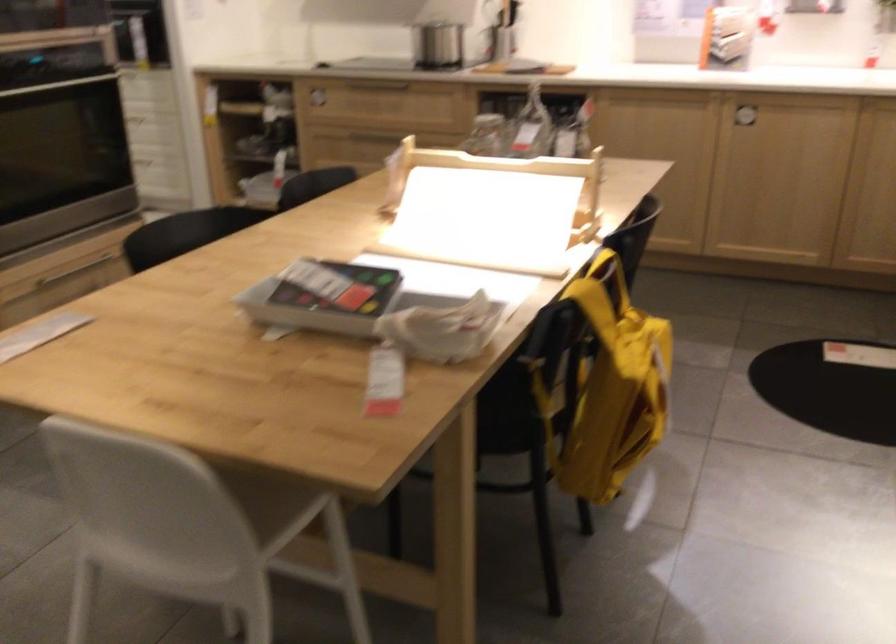
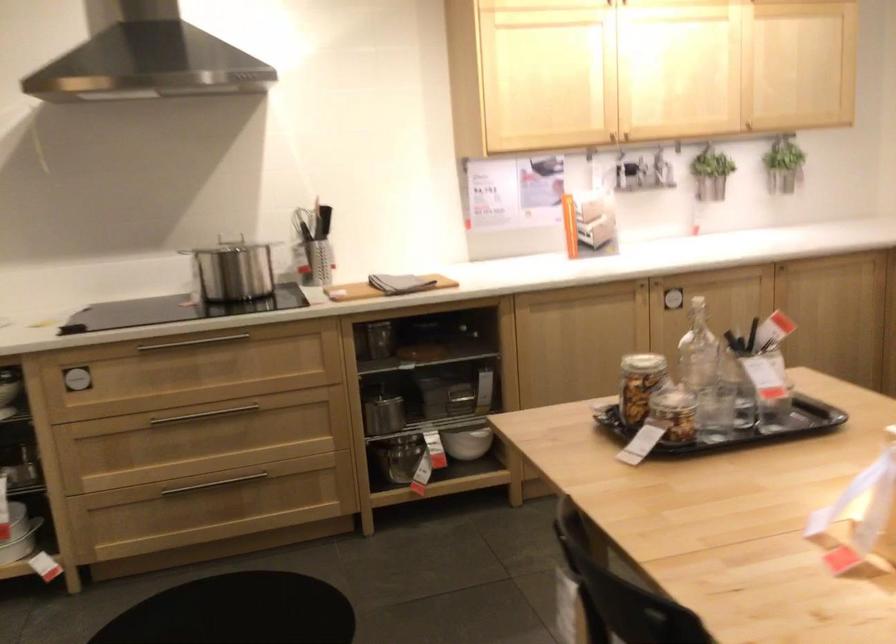
Locate, in the second image, the point that corresponds to (374,131) in the first image.

(200, 415)